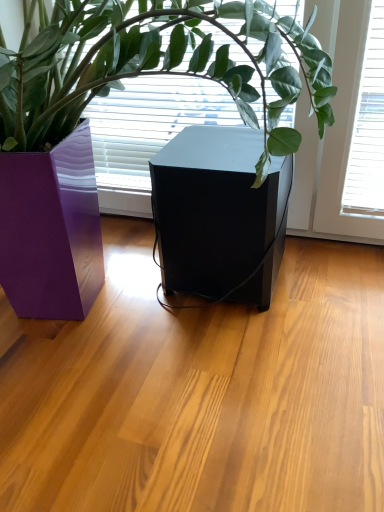
Find the location of `empty space that is to the right of black matte speaker at center`. empty space that is to the right of black matte speaker at center is located at coordinates (329, 274).